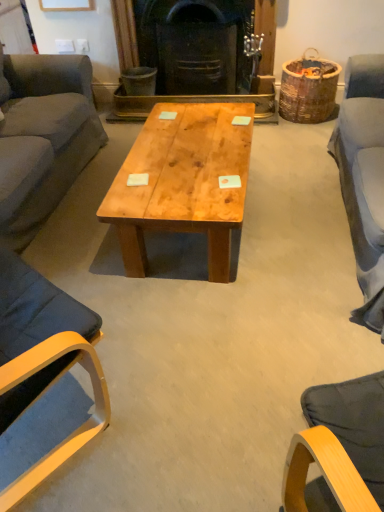
Question: Is black cast iron fireplace at center to the left or to the right of natural wood coffee table at center in the image?

Choices:
 (A) left
 (B) right

Answer: (B)

Question: Considering the positions of black cast iron fireplace at center and natural wood coffee table at center in the image, is black cast iron fireplace at center wider or thinner than natural wood coffee table at center?

Choices:
 (A) thin
 (B) wide

Answer: (A)

Question: Estimate the real-world distances between objects in this image. Which object is farther from the natural wood coffee table at center?

Choices:
 (A) dark gray fabric couch at left
 (B) black cast iron fireplace at center
 (C) matte wood chair at left

Answer: (B)

Question: Which is farther from the natural wood coffee table at center?

Choices:
 (A) dark gray fabric couch at left
 (B) black cast iron fireplace at center
 (C) matte wood chair at left

Answer: (B)